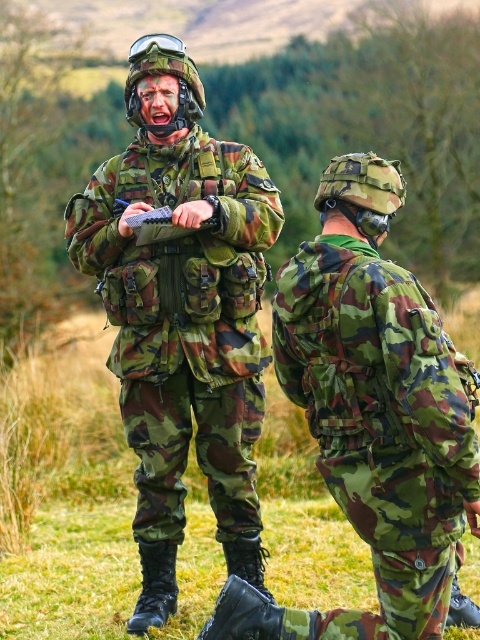
You are a drone operator controlling a drone that must hover exactly 15 feet above the ground. You need to fly the drone to the point marked at coordinates point [200,268]. Can the drone safely reach that point without exceeding its maximum altitude of 15 feet?

The distance between point [200,268] and the viewer is 17.02 feet, which exceeds the drone operator maximum altitude of 15 feet. The drone cannot safely reach that point without exceeding its limit.

You are a photographer positioned to the left of the scene. You want to take a photo that includes both the camouflage fabric uniform at center and the camouflage fabric backpack at center. Which object should you move closer to the camera to ensure both are visible in the frame?

The camouflage fabric uniform at center is to the left of camouflage fabric backpack at center. To include both in the frame, you should move the camouflage fabric backpack at center closer to the camera so that it aligns with the camouflage fabric uniform at center.

You are a photographer trying to capture a clear shot of the camouflage fabric uniform at center and the camouflage fabric backpack at center. Based on their positions, which one is closer to the camera?

The camouflage fabric uniform at center is located above the camouflage fabric backpack at center, so the camouflage fabric uniform at center is closer to the camera.